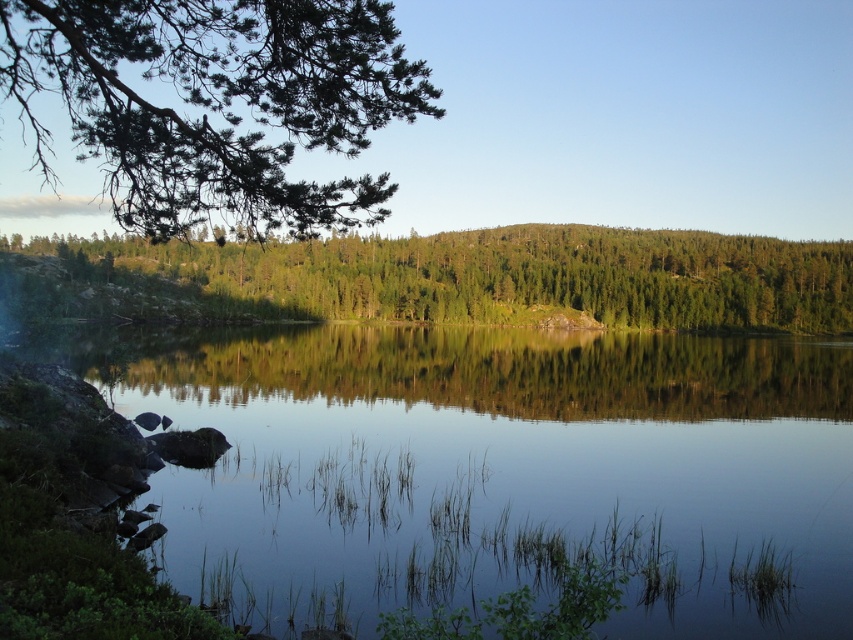
You are standing on the rocky shoreline on the left side of the lake. You want to walk to the clear water at center. Is the point marked at coordinates [495,470] on your path?

Yes, the point marked at coordinates [495,470] is on the clear water at center, so it is part of your path to reach the clear water at center.